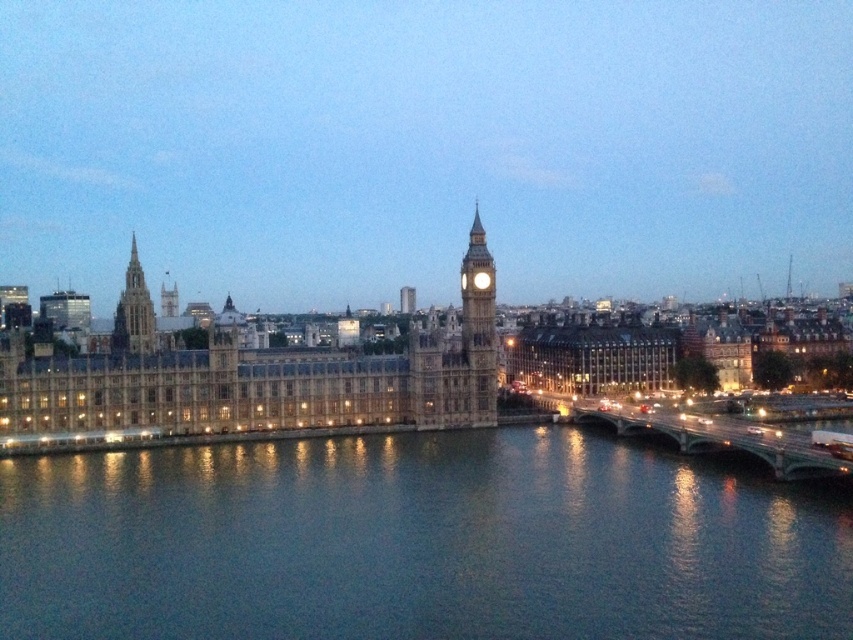
Can you confirm if concrete bridge at lower right is thinner than white stone clock at center?

In fact, concrete bridge at lower right might be wider than white stone clock at center.

Between point (598, 416) and point (479, 278), which one is positioned behind?

Positioned behind is point (479, 278).

Where is `concrete bridge at lower right`? Image resolution: width=853 pixels, height=640 pixels. concrete bridge at lower right is located at coordinates (722, 440).

Which is in front, point (152, 320) or point (473, 276)?

Point (473, 276)

Is the position of golden stone spire at upper left less distant than that of white stone clock at center?

No, golden stone spire at upper left is behind white stone clock at center.

Does point (125, 289) lie behind point (491, 278)?

That is True.

Find the location of a particular element. This screenshot has width=853, height=640. golden stone spire at upper left is located at coordinates (132, 310).

Is concrete bridge at lower right shorter than stone clock tower at center?

Correct, concrete bridge at lower right is not as tall as stone clock tower at center.

What do you see at coordinates (722, 440) in the screenshot? I see `concrete bridge at lower right` at bounding box center [722, 440].

Is point (834, 458) positioned behind point (465, 276)?

No, (834, 458) is in front of (465, 276).

Find the location of a particular element. This screenshot has height=640, width=853. concrete bridge at lower right is located at coordinates (722, 440).